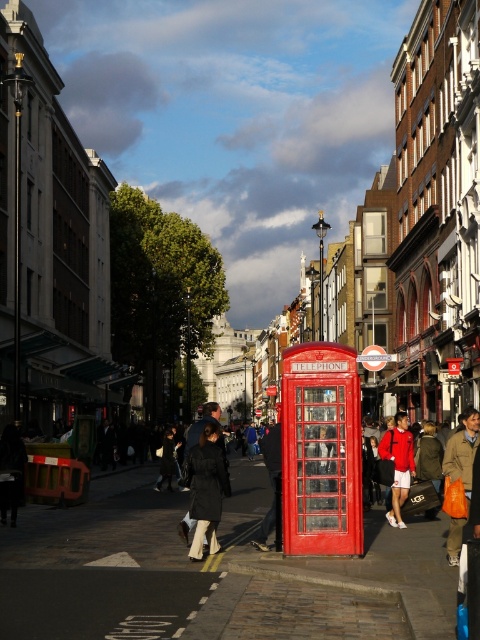
Question: Is black puffy coat at center below orange fabric bag at center?

Choices:
 (A) no
 (B) yes

Answer: (A)

Question: Among these objects, which one is nearest to the camera?

Choices:
 (A) orange fabric bag at center
 (B) red fabric jacket at center
 (C) black puffy coat at center

Answer: (A)

Question: Estimate the real-world distances between objects in this image. Which object is farther from the orange fabric bag at center?

Choices:
 (A) black puffy coat at center
 (B) red fabric jacket at center

Answer: (B)

Question: Considering the relative positions of black puffy coat at center and red fabric jacket at center in the image provided, where is black puffy coat at center located with respect to red fabric jacket at center?

Choices:
 (A) above
 (B) below

Answer: (A)

Question: Where is orange fabric bag at center located in relation to red fabric jacket at center in the image?

Choices:
 (A) right
 (B) left

Answer: (A)

Question: Which object is the closest to the orange fabric bag at center?

Choices:
 (A) black puffy coat at center
 (B) red fabric jacket at center

Answer: (A)